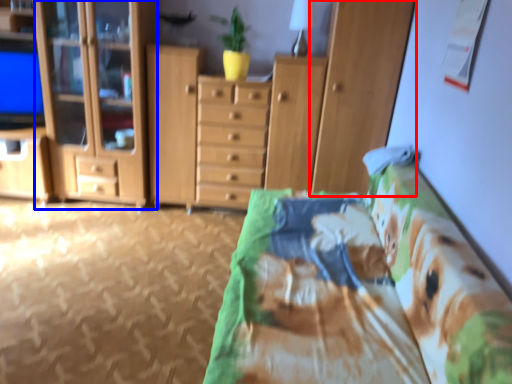
Question: Among these objects, which one is nearest to the camera, cabinetry (highlighted by a red box) or cabinetry (highlighted by a blue box)?

Choices:
 (A) cabinetry
 (B) cabinetry

Answer: (A)